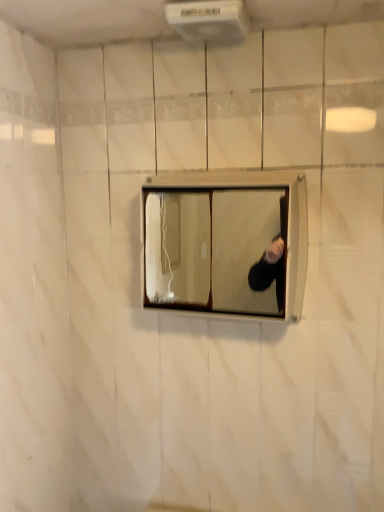
Question: From their relative heights in the image, would you say white plastic air conditioner at upper center is taller or shorter than matte wooden medicine cabinet at center?

Choices:
 (A) short
 (B) tall

Answer: (A)

Question: Is white plastic air conditioner at upper center inside or outside of matte wooden medicine cabinet at center?

Choices:
 (A) inside
 (B) outside

Answer: (B)

Question: In the image, is white plastic air conditioner at upper center positioned in front of or behind matte wooden medicine cabinet at center?

Choices:
 (A) front
 (B) behind

Answer: (A)

Question: Is matte wooden medicine cabinet at center situated inside white plastic air conditioner at upper center or outside?

Choices:
 (A) outside
 (B) inside

Answer: (A)

Question: Looking at their shapes, would you say matte wooden medicine cabinet at center is wider or thinner than white plastic air conditioner at upper center?

Choices:
 (A) wide
 (B) thin

Answer: (B)

Question: From the image's perspective, relative to white plastic air conditioner at upper center, is matte wooden medicine cabinet at center above or below?

Choices:
 (A) above
 (B) below

Answer: (B)

Question: Considering the positions of point (236, 307) and point (188, 3), is point (236, 307) closer or farther from the camera than point (188, 3)?

Choices:
 (A) farther
 (B) closer

Answer: (A)